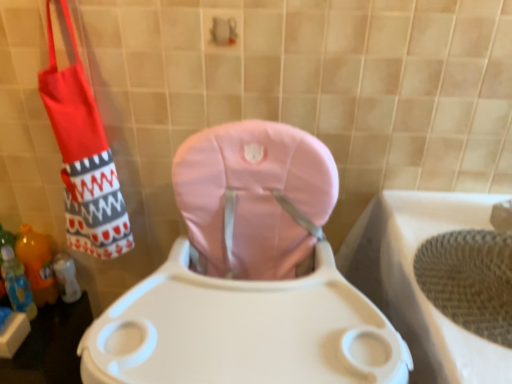
Question: Is translucent orange bottle at lower left, which ranks as the 1th bottle in back-to-front order, taller or shorter than pink fabric toilet at center?

Choices:
 (A) tall
 (B) short

Answer: (B)

Question: Is translucent orange bottle at lower left, the second bottle positioned from the front, inside the boundaries of pink fabric toilet at center, or outside?

Choices:
 (A) outside
 (B) inside

Answer: (A)

Question: Which is nearer to the translucent orange bottle at lower left, arranged as the second bottle when viewed from the back?

Choices:
 (A) red fabric shoulder bag at left
 (B) pink fabric toilet at center
 (C) translucent orange bottle at lower left, which ranks as the 1th bottle in back-to-front order
 (D) woven beige bath at lower right

Answer: (C)

Question: Estimate the real-world distances between objects in this image. Which object is farther from the red fabric shoulder bag at left?

Choices:
 (A) woven beige bath at lower right
 (B) pink fabric toilet at center
 (C) translucent orange bottle at lower left, which ranks as the 1th bottle in back-to-front order
 (D) translucent orange bottle at lower left, which appears as the 1th bottle when viewed from the front

Answer: (A)